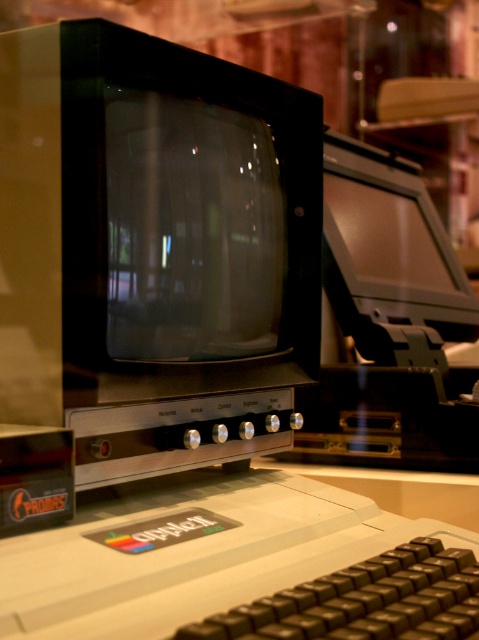
Question: Which object is positioned closest to the black plastic keyboard at lower center?

Choices:
 (A) white plastic keyboard at lower center
 (B) matte black monitor at upper right

Answer: (A)

Question: Is white plastic keyboard at lower center wider than matte black monitor at upper right?

Choices:
 (A) no
 (B) yes

Answer: (B)

Question: Is white plastic keyboard at lower center positioned behind matte black monitor at upper right?

Choices:
 (A) yes
 (B) no

Answer: (B)

Question: Which point is closer to the camera taking this photo?

Choices:
 (A) (122, 500)
 (B) (376, 323)
 (C) (436, 637)

Answer: (C)

Question: Can you confirm if matte black monitor at upper right is positioned to the left of black plastic keyboard at lower center?

Choices:
 (A) no
 (B) yes

Answer: (A)

Question: Which point is closer to the camera taking this photo?

Choices:
 (A) (394, 636)
 (B) (6, 577)

Answer: (A)